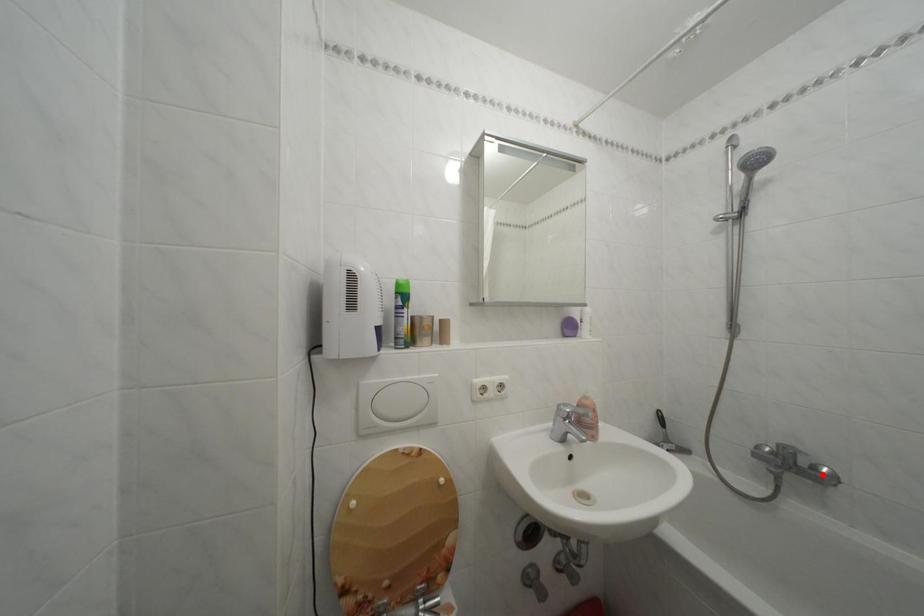
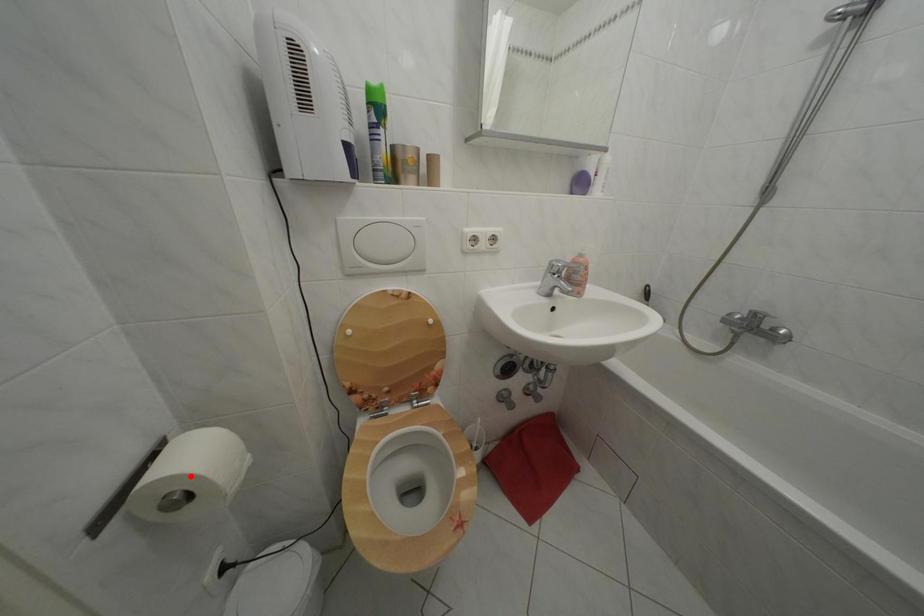
I am providing you with two images of the same scene from different viewpoints. A red point is marked on the first image and another point is marked on the second image. Does the point marked in image1 correspond to the same location as the one in image2?

No